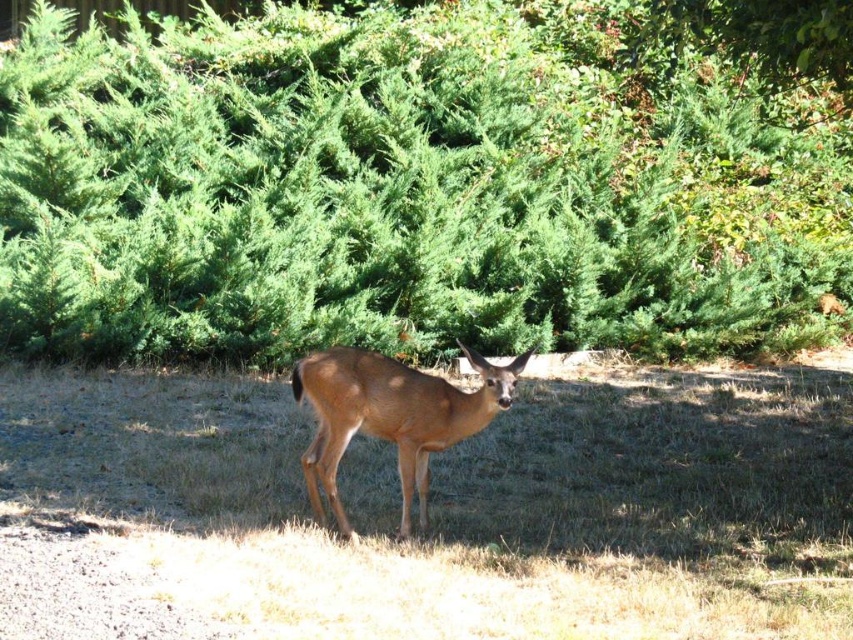
From the picture: Is brown dry grass at center wider than brown matte/deer at center?

Incorrect, brown dry grass at center's width does not surpass brown matte/deer at center's.

Who is lower down, brown dry grass at center or brown matte/deer at center?

brown dry grass at center

Where is `brown dry grass at center`? This screenshot has height=640, width=853. brown dry grass at center is located at coordinates (436, 513).

Locate an element on the screen. This screenshot has height=640, width=853. brown dry grass at center is located at coordinates (436, 513).

Can you confirm if green leafy bush at center is thinner than brown matte/deer at center?

No.

This screenshot has height=640, width=853. Describe the element at coordinates (424, 180) in the screenshot. I see `green leafy bush at center` at that location.

Where is `green leafy bush at center`? green leafy bush at center is located at coordinates (424, 180).

Is point (486, 156) closer to camera compared to point (686, 625)?

No, it is behind (686, 625).

Identify the location of green leafy bush at center. (424, 180).